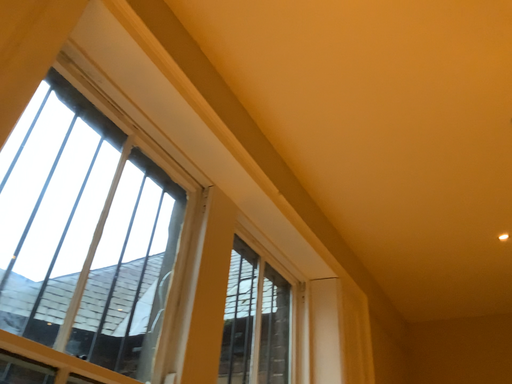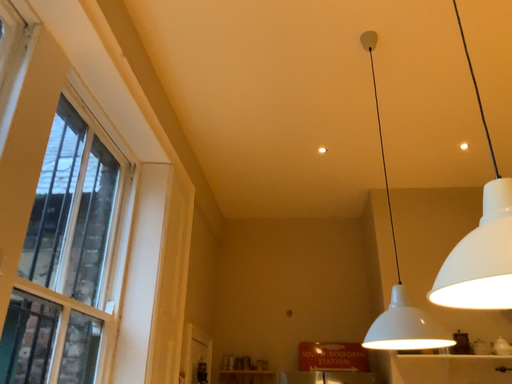
Question: Which way did the camera rotate in the video?

Choices:
 (A) rotated left
 (B) rotated right

Answer: (B)